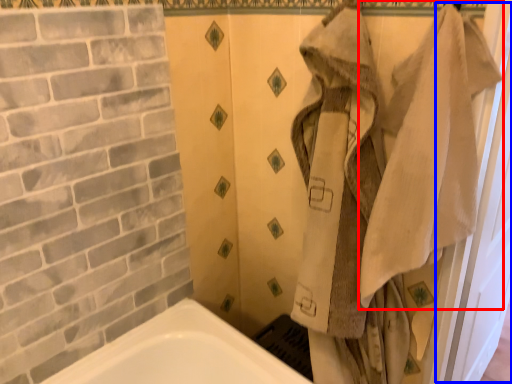
Question: Which object is closer to the camera taking this photo, bath towel (highlighted by a red box) or screen door (highlighted by a blue box)?

Choices:
 (A) bath towel
 (B) screen door

Answer: (A)